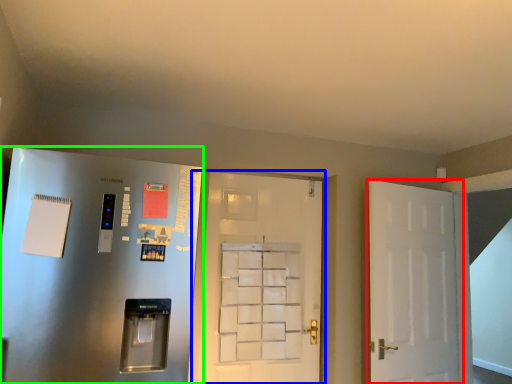
Question: Which object is the closest to the door (highlighted by a red box)? Choose among these: door (highlighted by a blue box) or door (highlighted by a green box).

Choices:
 (A) door
 (B) door

Answer: (A)